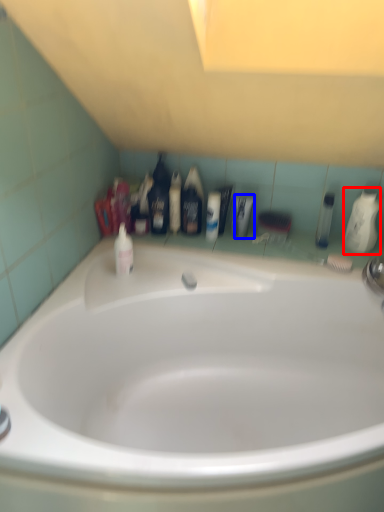
Question: Among these objects, which one is farthest to the camera, mouthwash (highlighted by a red box) or toiletry (highlighted by a blue box)?

Choices:
 (A) mouthwash
 (B) toiletry

Answer: (B)